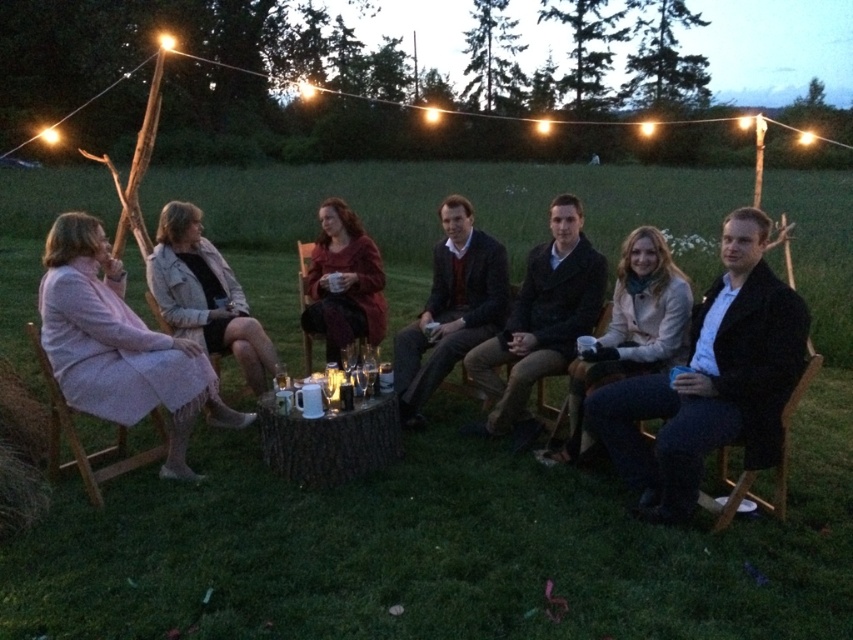
You are standing in front of the table and want to hand a drink to the person wearing the dark brown leather jacket at center and the light gray textured jacket at center. Which jacket should you reach for first to ensure you can easily access both?

You should reach for the dark brown leather jacket at center first since it is closer to you than the light gray textured jacket at center, allowing easier access before reaching further for the latter.

You are a photographer standing 3 meters away from the dark blue jeans at center and the matte red dress at center. You want to take a photo of both of them in the same frame. Can you do that without moving your position?

The dark blue jeans at center is 2.22 meters away from the matte red dress at center. Since you are 3 meters away from both, the distance between them is less than your distance from them, so they can be captured in the same frame without moving.